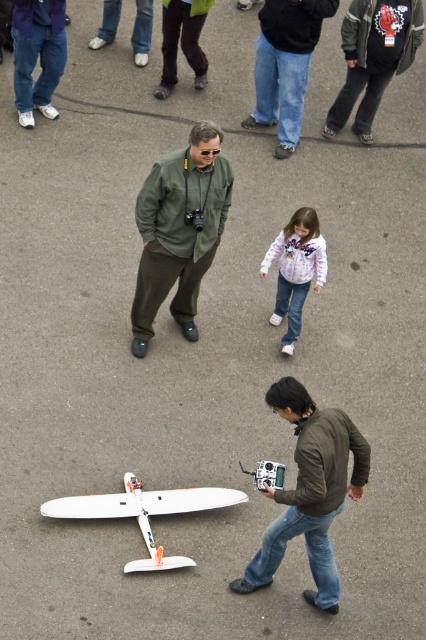
Question: Does white matte airplane at lower center have a greater width compared to white fleece jacket at center?

Choices:
 (A) yes
 (B) no

Answer: (A)

Question: Can you confirm if white matte airplane at lower center is positioned to the right of brown leather pants at upper center?

Choices:
 (A) yes
 (B) no

Answer: (B)

Question: Which of the following is the farthest from the observer?

Choices:
 (A) (325, 269)
 (B) (146, 333)
 (C) (22, 124)
 (D) (140, 568)

Answer: (C)

Question: Which point is closer to the camera taking this photo?

Choices:
 (A) (129, 488)
 (B) (180, 224)
 (C) (337, 598)
 (D) (60, 61)

Answer: (C)

Question: Estimate the real-world distances between objects in this image. Which object is farther from the white fleece jacket at center?

Choices:
 (A) denim pants at upper left
 (B) brown leather jacket at lower right
 (C) brown leather pants at upper center
 (D) green matte jacket at center

Answer: (C)

Question: Does green matte jacket at center appear over brown leather pants at upper center?

Choices:
 (A) no
 (B) yes

Answer: (A)